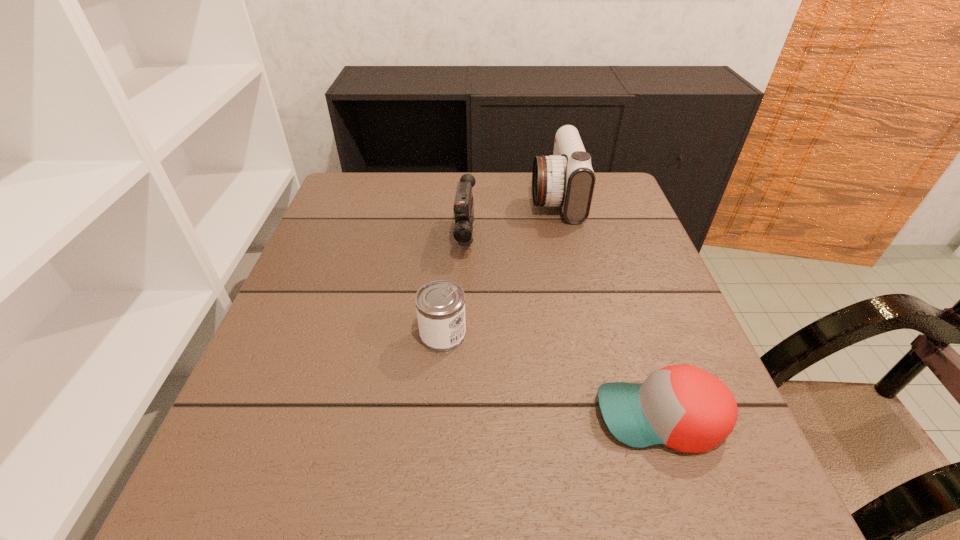
In the image, there is a desktop. Identify the location of free space at the near edge. (558, 485).

Locate an element on the screen. This screenshot has height=540, width=960. vacant region at the left edge is located at coordinates [x=214, y=447].

Image resolution: width=960 pixels, height=540 pixels. In the image, there is a desktop. In order to click on vacant space at the right edge in this screenshot , I will do `click(611, 222)`.

The height and width of the screenshot is (540, 960). I want to click on free space at the far left corner of the desktop, so click(x=377, y=200).

Locate an element on the screen. free space at the near right corner of the desktop is located at coordinates click(x=733, y=523).

This screenshot has height=540, width=960. I want to click on vacant area between the right camcorder and the nearest object, so click(x=608, y=307).

Locate an element on the screen. This screenshot has width=960, height=540. free space between the baseball cap and the second nearest object is located at coordinates (552, 376).

Find the location of `free space between the second tallest object and the taller camcorder`. free space between the second tallest object and the taller camcorder is located at coordinates (511, 218).

Locate an element on the screen. vacant point located between the second shortest object and the baseball cap is located at coordinates (552, 376).

The image size is (960, 540). Find the location of `vacant region between the taller camcorder and the shortest object`. vacant region between the taller camcorder and the shortest object is located at coordinates (608, 307).